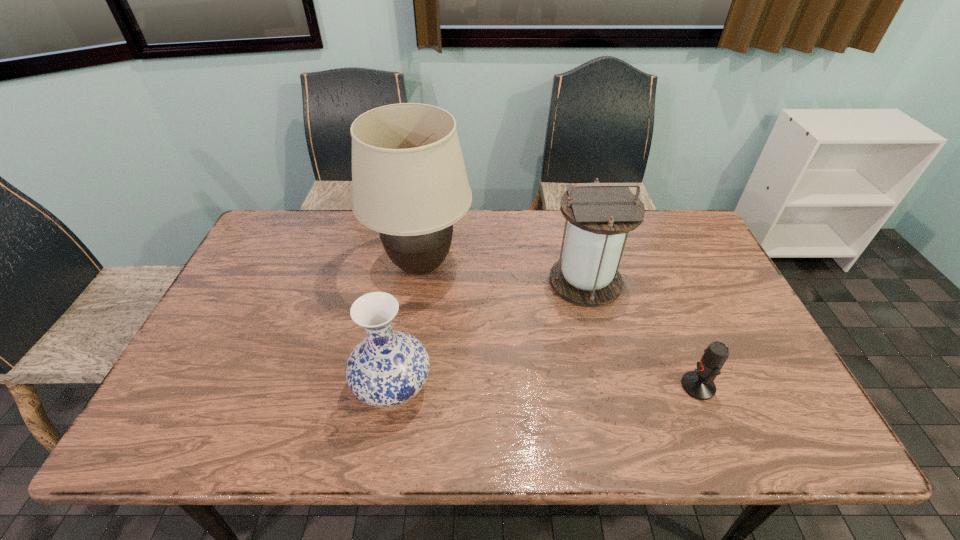
Locate an element on the screen. Image resolution: width=960 pixels, height=540 pixels. lampshade is located at coordinates (409, 181).

Identify the location of the third shortest object. The width and height of the screenshot is (960, 540). 600,214.

Locate an element on the screen. This screenshot has height=540, width=960. the second object from right to left is located at coordinates (600, 214).

Locate an element on the screen. This screenshot has height=540, width=960. the second shortest object is located at coordinates (387, 368).

Identify the location of the rightmost object. This screenshot has height=540, width=960. (699, 384).

Find the location of `microphone`. microphone is located at coordinates (699, 384).

Image resolution: width=960 pixels, height=540 pixels. What are the coordinates of `vacant area situated 0.150m on the left of the tallest object` in the screenshot? It's located at (320, 266).

Locate an element on the screen. The height and width of the screenshot is (540, 960). vacant space situated on the front of the lantern is located at coordinates (599, 339).

At what (x,y) coordinates should I click in order to perform the action: click on free space located on the back of the second shortest object. Please return your answer as a coordinate pair (x, y). Image resolution: width=960 pixels, height=540 pixels. Looking at the image, I should click on (405, 311).

You are a GUI agent. You are given a task and a screenshot of the screen. Output one action in this format:
    pyautogui.click(x=<x>, y=<y>)
    Task: Click on the vacant region located 0.370m on the side of the shortest object with the red ring
    
    Given the screenshot: What is the action you would take?
    pyautogui.click(x=527, y=386)